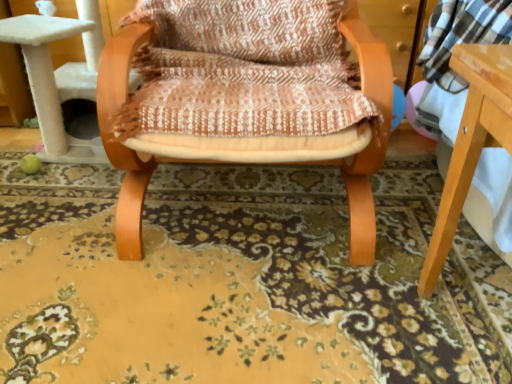
Question: Do you think floral carpet at center is within wooden chair at center, or outside of it?

Choices:
 (A) inside
 (B) outside

Answer: (B)

Question: Visually, is floral carpet at center positioned to the left or to the right of wooden chair at center?

Choices:
 (A) left
 (B) right

Answer: (A)

Question: From the image's perspective, is floral carpet at center positioned above or below wooden chair at center?

Choices:
 (A) above
 (B) below

Answer: (B)

Question: Is wooden chair at center inside the boundaries of floral carpet at center, or outside?

Choices:
 (A) inside
 (B) outside

Answer: (B)

Question: From the image's perspective, is wooden chair at center above or below floral carpet at center?

Choices:
 (A) below
 (B) above

Answer: (B)

Question: Considering the positions of wooden chair at center and floral carpet at center in the image, is wooden chair at center taller or shorter than floral carpet at center?

Choices:
 (A) short
 (B) tall

Answer: (B)

Question: Would you say wooden chair at center is to the left or to the right of floral carpet at center in the picture?

Choices:
 (A) left
 (B) right

Answer: (B)